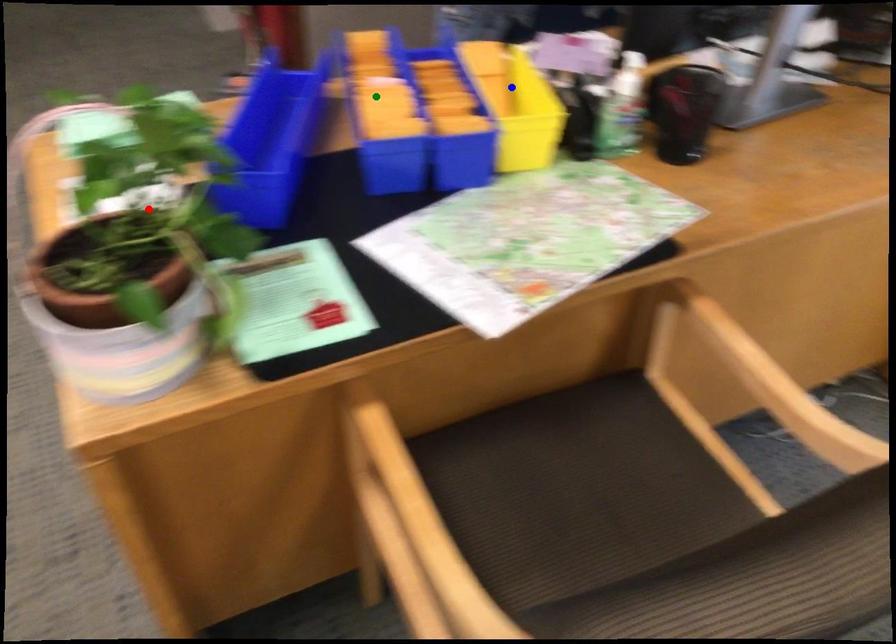
Order these from nearest to farthest:
A) green point
B) red point
C) blue point

1. red point
2. green point
3. blue point